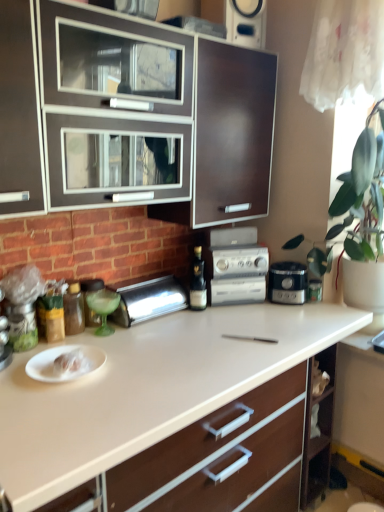
Question: Does point (198, 283) appear closer or farther from the camera than point (8, 207)?

Choices:
 (A) closer
 (B) farther

Answer: (B)

Question: Looking at their shapes, would you say black glass bottle at center, the second bottle in the front-to-back sequence, is wider or thinner than matte brown cabinet at upper center?

Choices:
 (A) wide
 (B) thin

Answer: (B)

Question: Estimate the real-world distances between objects in this image. Which object is farther from the satin black coffee maker at center?

Choices:
 (A) metallic silver spice container at left, the 1th appliance when ordered from front to back
 (B) brown glass bottle at left, the 1th bottle from the front
 (C) white glossy countertop at center
 (D) black glass bottle at center, the second bottle in the front-to-back sequence
 (E) silver metallic stereo at center

Answer: (A)

Question: Which is farther from the satin black coffee maker at center?

Choices:
 (A) black glass bottle at center, the second bottle in the front-to-back sequence
 (B) silver metallic breadbox at left, acting as the 2th appliance starting from the front
 (C) metallic silver spice container at left, arranged as the 1th appliance when viewed from the left
 (D) white glossy countertop at center
 (E) white paper plate at lower left

Answer: (C)